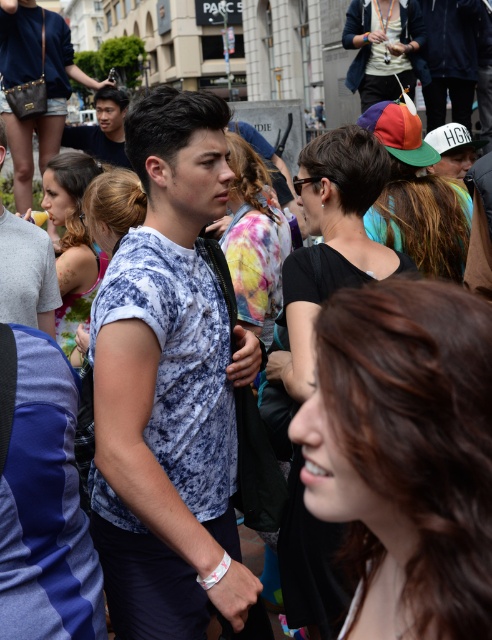
Question: Is matte white t-shirt at center below matte black shirt at upper center?

Choices:
 (A) no
 (B) yes

Answer: (B)

Question: Which point appears farthest from the camera in this image?

Choices:
 (A) (111, 131)
 (B) (17, 289)

Answer: (A)

Question: Which object appears closest to the camera in this image?

Choices:
 (A) matte white t-shirt at center
 (B) matte black shirt at upper center
 (C) tie-dye fabric shirt at center

Answer: (C)

Question: Which point is farther to the camera?

Choices:
 (A) matte black shirt at upper center
 (B) matte white t-shirt at center

Answer: (A)

Question: Is matte white t-shirt at center below matte black shirt at upper center?

Choices:
 (A) yes
 (B) no

Answer: (A)

Question: Is matte white t-shirt at center to the left of matte black shirt at upper center from the viewer's perspective?

Choices:
 (A) yes
 (B) no

Answer: (B)